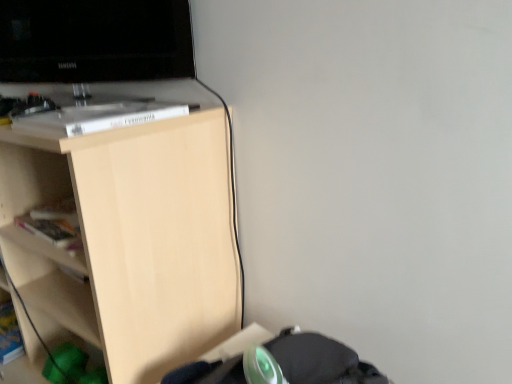
Question: From a real-world perspective, is black glossy television at upper left positioned above or below light wood shelf at upper left?

Choices:
 (A) above
 (B) below

Answer: (A)

Question: Is black glossy television at upper left inside or outside of light wood shelf at upper left?

Choices:
 (A) inside
 (B) outside

Answer: (B)

Question: Looking at the image, does black glossy television at upper left seem bigger or smaller compared to light wood shelf at upper left?

Choices:
 (A) small
 (B) big

Answer: (A)

Question: Looking at their shapes, would you say light wood shelf at upper left is wider or thinner than black glossy television at upper left?

Choices:
 (A) wide
 (B) thin

Answer: (A)

Question: Which is correct: light wood shelf at upper left is inside black glossy television at upper left, or outside of it?

Choices:
 (A) inside
 (B) outside

Answer: (B)

Question: In the image, is light wood shelf at upper left positioned in front of or behind black glossy television at upper left?

Choices:
 (A) behind
 (B) front

Answer: (B)

Question: From a real-world perspective, is light wood shelf at upper left above or below black glossy television at upper left?

Choices:
 (A) above
 (B) below

Answer: (B)